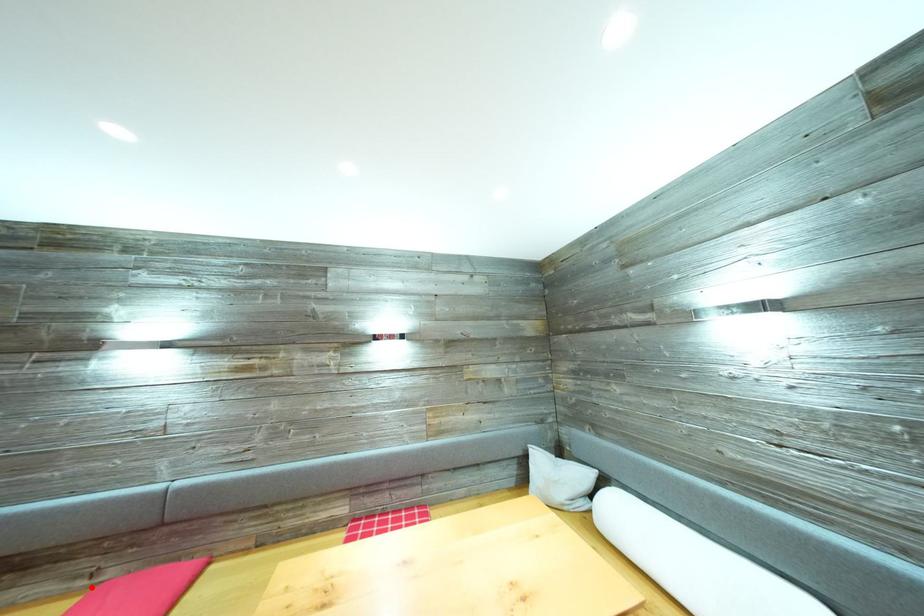
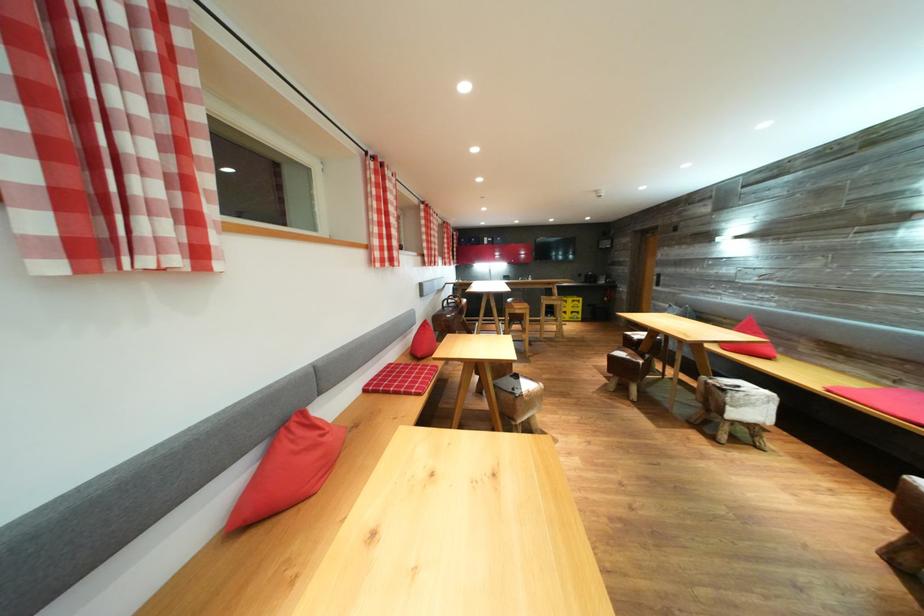
In the second image, find the point that corresponds to the highlighted location in the first image.

(895, 389)